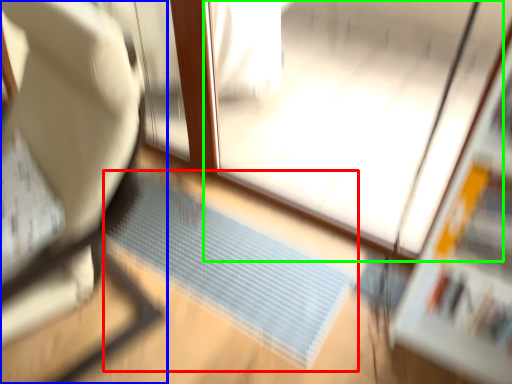
Question: Which object is positioned closest to doormat (highlighted by a red box)? Select from furniture (highlighted by a blue box) and screen door (highlighted by a green box).

Choices:
 (A) furniture
 (B) screen door

Answer: (B)